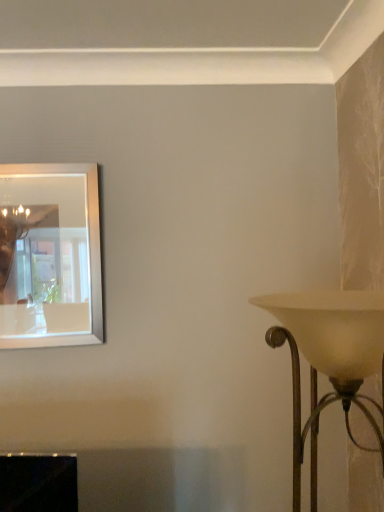
Question: Should I look upward or downward to see silver/metallic mirror at upper left?

Choices:
 (A) down
 (B) up

Answer: (A)